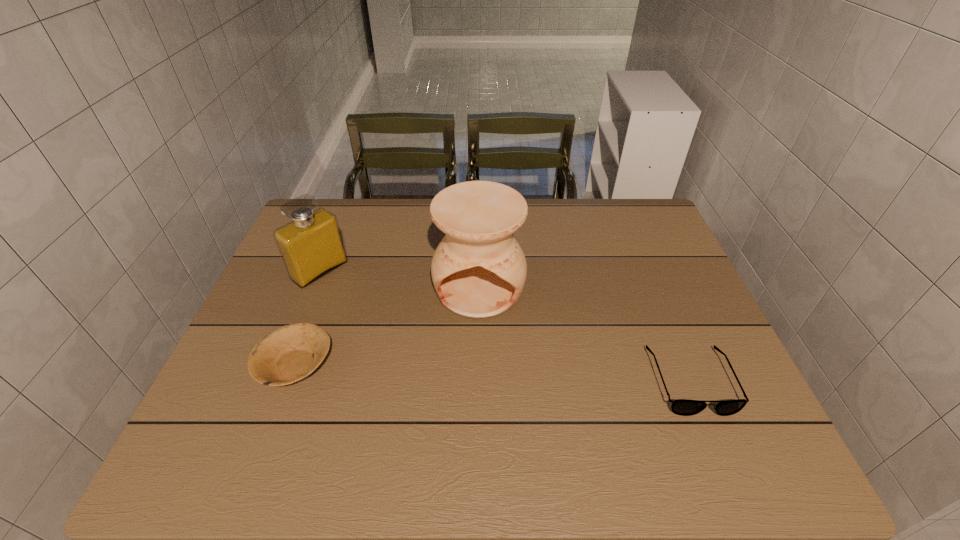
This screenshot has height=540, width=960. In order to click on free spot at the left edge of the desktop in this screenshot , I will do `click(280, 326)`.

At what (x,y) coordinates should I click in order to perform the action: click on vacant position at the right edge of the desktop. Please return your answer as a coordinate pair (x, y). Looking at the image, I should click on (637, 258).

At what (x,y) coordinates should I click in order to perform the action: click on vacant space at the far left corner of the desktop. Please return your answer as a coordinate pair (x, y). The image size is (960, 540). Looking at the image, I should click on (342, 214).

Locate an element on the screen. blank space at the far right corner of the desktop is located at coordinates (610, 208).

Where is `vacant point located between the spectacles and the bowl`? vacant point located between the spectacles and the bowl is located at coordinates (493, 374).

Locate an element on the screen. vacant area between the bowl and the second object from right to left is located at coordinates (387, 327).

What are the coordinates of `free space between the pottery and the spectacles` in the screenshot? It's located at 585,334.

The height and width of the screenshot is (540, 960). Identify the location of free area in between the perfume and the rightmost object. (505, 326).

Locate an element on the screen. Image resolution: width=960 pixels, height=540 pixels. vacant region between the bowl and the spectacles is located at coordinates (493, 374).

Image resolution: width=960 pixels, height=540 pixels. I want to click on vacant area that lies between the rightmost object and the third object from left to right, so click(585, 334).